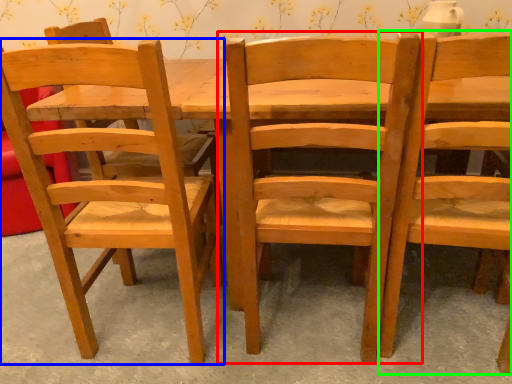
Question: Considering the real-world distances, which object is farthest from chair (highlighted by a red box)? chair (highlighted by a blue box) or chair (highlighted by a green box)?

Choices:
 (A) chair
 (B) chair

Answer: (A)